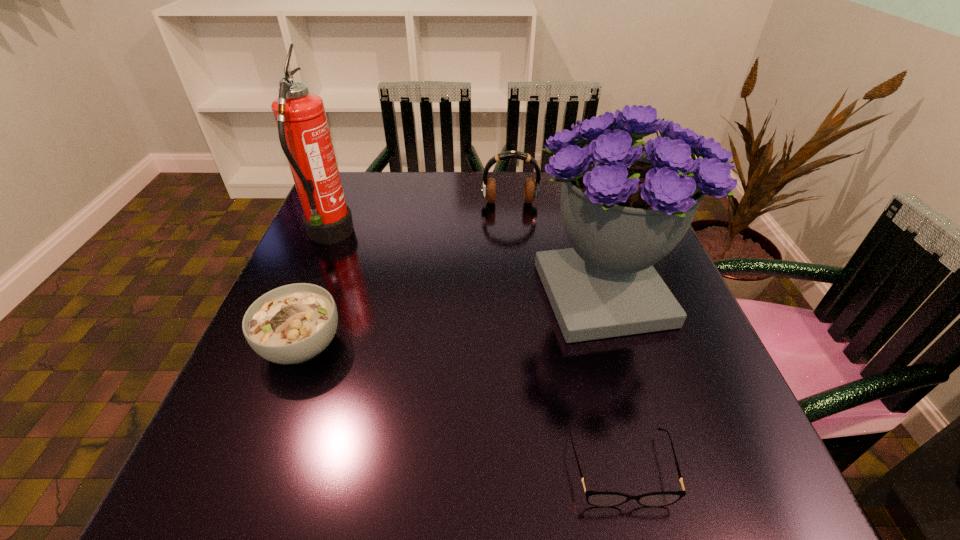
Find the location of a particular element. The image size is (960, 540). free space between the third tallest object and the bouquet is located at coordinates (557, 248).

This screenshot has height=540, width=960. I want to click on unoccupied area between the bouquet and the fire extinguisher, so click(x=467, y=265).

Locate an element on the screen. The width and height of the screenshot is (960, 540). empty location between the shortest object and the bouquet is located at coordinates (612, 381).

The width and height of the screenshot is (960, 540). I want to click on empty space between the fire extinguisher and the bouquet, so click(467, 265).

Where is `empty space between the shortest object and the fire extinguisher`? empty space between the shortest object and the fire extinguisher is located at coordinates (474, 352).

The image size is (960, 540). I want to click on object that stands as the second closest to the fourth tallest object, so click(x=625, y=205).

Locate an element on the screen. The width and height of the screenshot is (960, 540). object that is the second closest to the nearest object is located at coordinates (293, 323).

The height and width of the screenshot is (540, 960). I want to click on vacant area in the image that satisfies the following two spatial constraints: 1. on the front-facing side of the fourth tallest object; 2. on the left side of the fire extinguisher, so click(x=283, y=345).

At what (x,y) coordinates should I click in order to perform the action: click on vacant region that satisfies the following two spatial constraints: 1. on the ear cup of the farthest object; 2. on the front-facing side of the fire extinguisher. Please return your answer as a coordinate pair (x, y). Image resolution: width=960 pixels, height=540 pixels. Looking at the image, I should click on coord(513,237).

Image resolution: width=960 pixels, height=540 pixels. Identify the location of vacant space that satisfies the following two spatial constraints: 1. on the front-facing side of the fire extinguisher; 2. on the back side of the soup bowl. (283, 345).